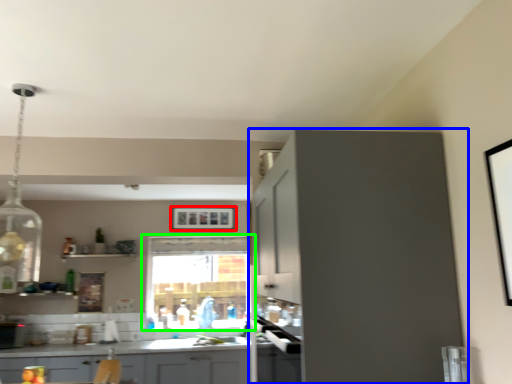
Question: Which object is the farthest from picture frame (highlighted by a red box)? Choose among these: cabinetry (highlighted by a blue box) or window (highlighted by a green box).

Choices:
 (A) cabinetry
 (B) window

Answer: (A)